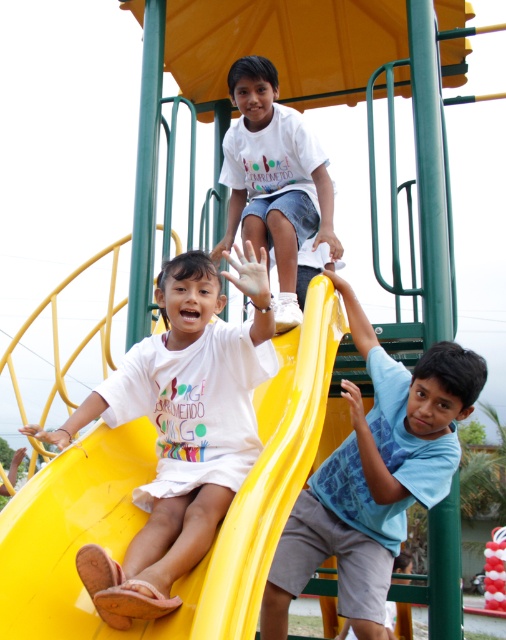
You are standing at the playground and see two points marked on the slide structure. The first point is at coordinates point (11, 582) and the second point is at coordinates point (425, 401). Which point is closer to you?

Point (11, 582) is in front of point (425, 401), so it is closer to you.

Based on the scene described, where is the yellow plastic slide at center located in relation to the white cotton shirt at upper center?

The yellow plastic slide at center is to the right of the white cotton shirt at upper center.

You are a photographer trying to capture a photo of the blue printed shirt at upper right and the yellow plastic slide at center. Which object should you focus on first if you want to include both in your frame without moving the camera?

You should focus on the yellow plastic slide at center first because it is positioned on the left side of the blue printed shirt at upper right, so capturing the left side first will ensure both objects are included in the frame.